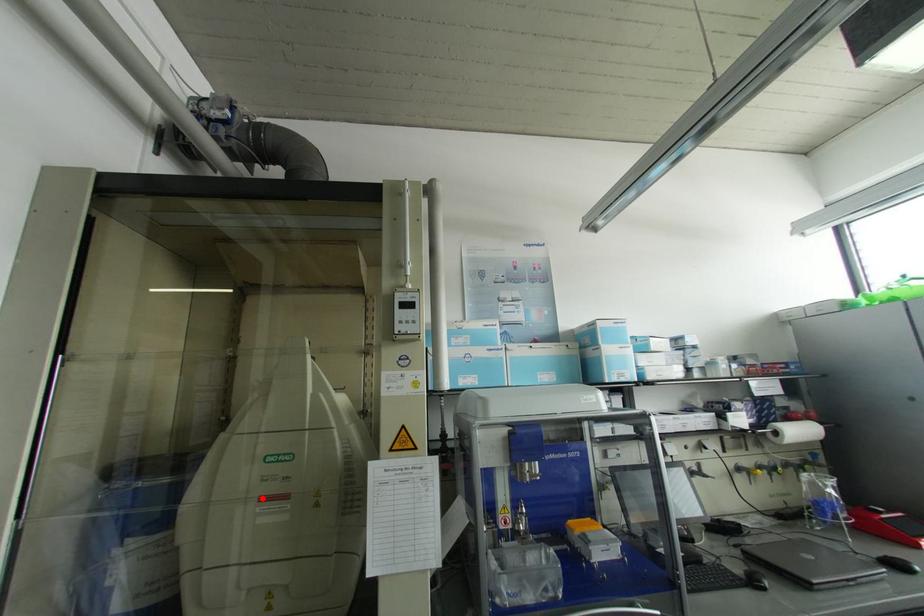
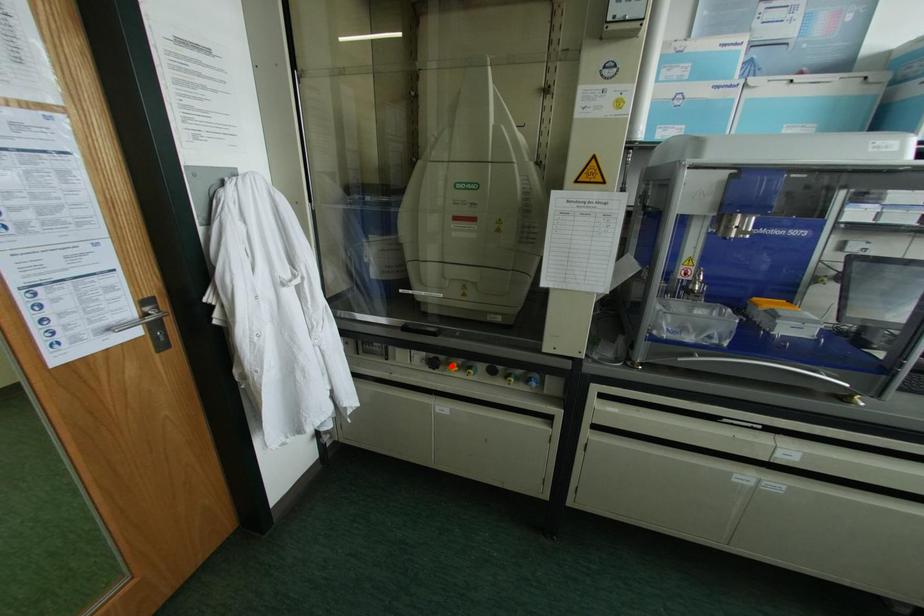
I am providing you with two images of the same scene from different viewpoints. A red point is marked on the first image and another point is marked on the second image. Is the red point in image1 aligned with the point shown in image2?

No